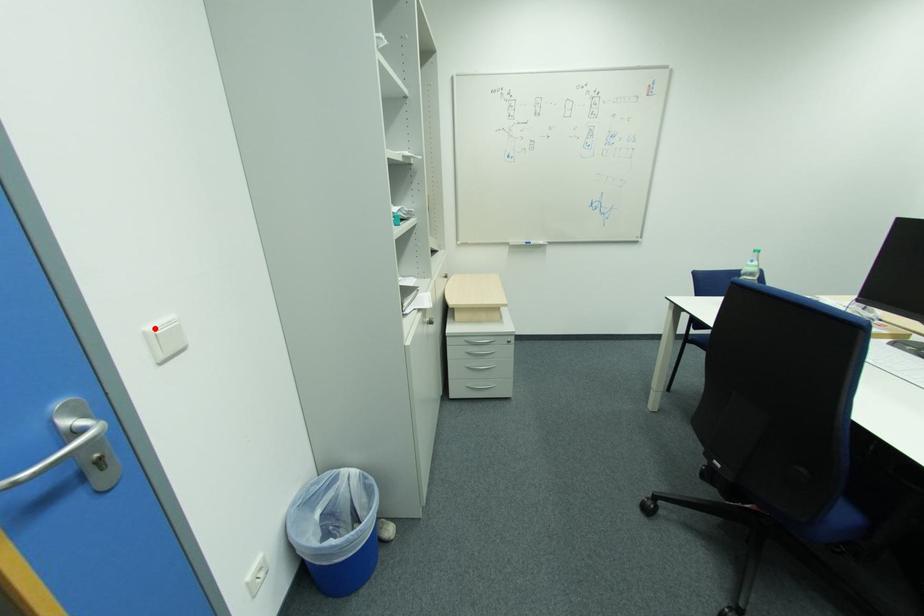
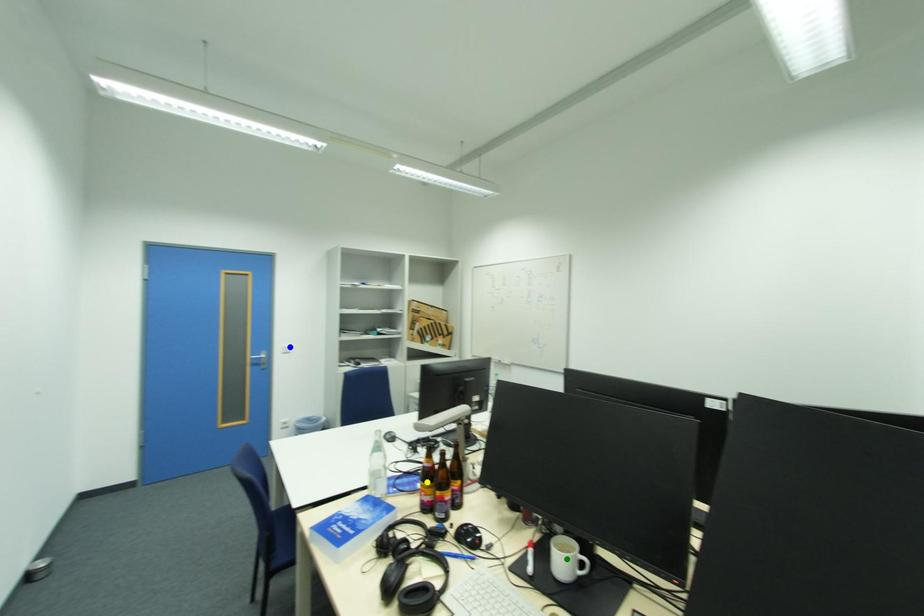
Question: I am providing you with two images of the same scene from different viewpoints. A red point is marked on the first image. You are given multiple points on the second image. Which spot in image 2 lines up with the point in image 1?

Choices:
 (A) yellow point
 (B) blue point
 (C) green point

Answer: (B)